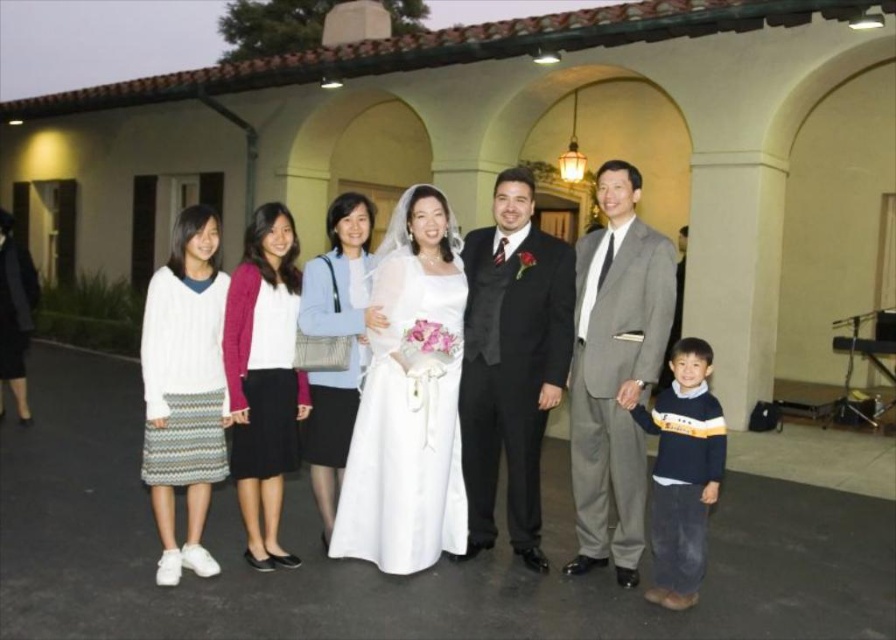
Does white satin dress at center have a greater height compared to gray suit at right?

No, white satin dress at center is not taller than gray suit at right.

Who is shorter, white satin dress at center or gray suit at right?

With less height is white satin dress at center.

Is point (445, 394) in front of point (614, 189)?

Yes, it is in front of point (614, 189).

Locate an element on the screen. The image size is (896, 640). white satin dress at center is located at coordinates (407, 428).

Between shiny black suit at center and light blue fabric purse at center, which one has more height?

Standing taller between the two is shiny black suit at center.

Is shiny black suit at center in front of light blue fabric purse at center?

No, it is behind light blue fabric purse at center.

Which is behind, point (535, 275) or point (378, 317)?

Point (535, 275)

At what (x,y) coordinates should I click in order to perform the action: click on shiny black suit at center. Please return your answer as a coordinate pair (x, y). Looking at the image, I should click on (511, 362).

Is shiny black suit at center positioned before dark blue sweater at lower right?

No, shiny black suit at center is further to the viewer.

Does point (509, 358) come closer to viewer compared to point (632, 417)?

That is False.

The height and width of the screenshot is (640, 896). What are the coordinates of `shiny black suit at center` in the screenshot? It's located at pos(511,362).